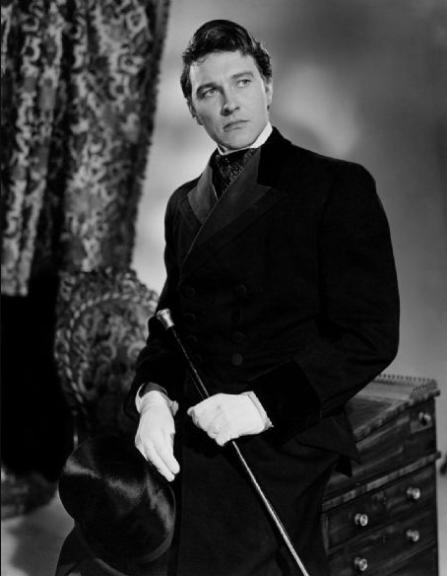
You are a GUI agent. You are given a task and a screenshot of the screen. Output one action in this format:
    pyautogui.click(x=<x>, y=<y>)
    Task: Click on the knobs
    This screenshot has width=447, height=576.
    Given the screenshot: What is the action you would take?
    pyautogui.click(x=358, y=518), pyautogui.click(x=409, y=494), pyautogui.click(x=415, y=536), pyautogui.click(x=361, y=560)